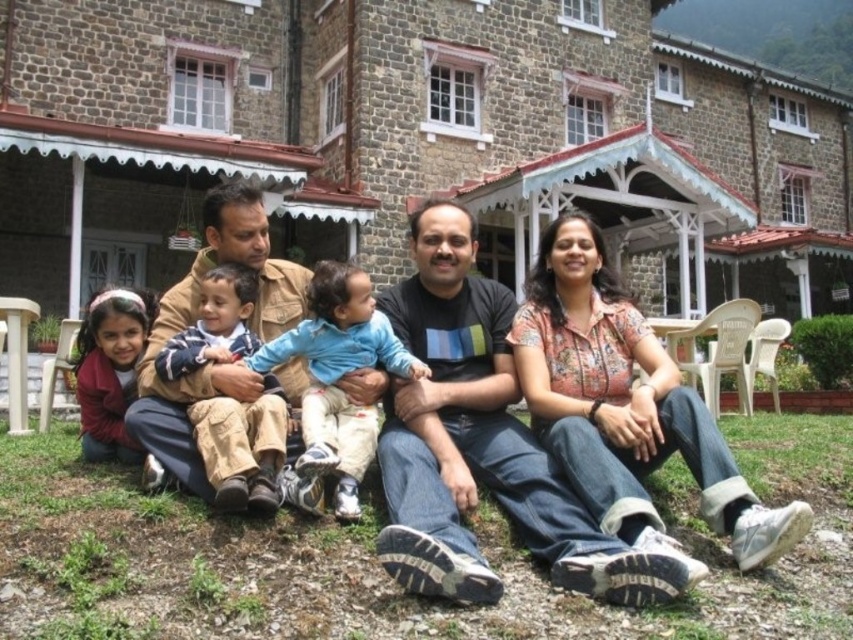
Does point (201, 445) lie behind point (126, 310)?

No, it is in front of (126, 310).

Who is more distant from viewer, (196,353) or (105,400)?

Positioned behind is point (105,400).

Which is behind, point (276, 486) or point (117, 448)?

The point (117, 448) is behind.

Locate an element on the screen. striped cotton shirt at center is located at coordinates (242, 445).

Which is more to the right, dark blue t-shirt at center or striped cotton shirt at center?

dark blue t-shirt at center is more to the right.

I want to click on dark blue t-shirt at center, so click(x=480, y=442).

Find the location of a particular element. This screenshot has height=640, width=853. dark blue t-shirt at center is located at coordinates (480, 442).

Who is more forward, (573, 544) or (111, 364)?

Point (573, 544) is more forward.

Can you confirm if matte black shirt at center is positioned to the left of matte red sweater at lower left?

Incorrect, matte black shirt at center is not on the left side of matte red sweater at lower left.

What do you see at coordinates (485, 444) in the screenshot? The height and width of the screenshot is (640, 853). I see `matte black shirt at center` at bounding box center [485, 444].

Find the location of a particular element. matte black shirt at center is located at coordinates (485, 444).